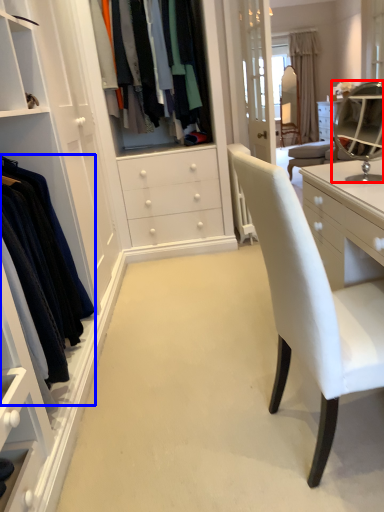
Question: Which object is closer to the camera taking this photo, mirror (highlighted by a red box) or clothing (highlighted by a blue box)?

Choices:
 (A) mirror
 (B) clothing

Answer: (B)